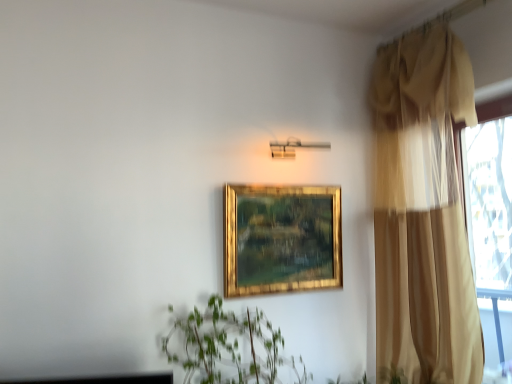
Question: Relative to beige sheer curtain at right, is gold/gilded picture frame at center in front or behind?

Choices:
 (A) front
 (B) behind

Answer: (B)

Question: From the image's perspective, relative to beige sheer curtain at right, is gold/gilded picture frame at center above or below?

Choices:
 (A) below
 (B) above

Answer: (A)

Question: Looking at their shapes, would you say gold/gilded picture frame at center is wider or thinner than beige sheer curtain at right?

Choices:
 (A) wide
 (B) thin

Answer: (B)

Question: Looking at their shapes, would you say beige sheer curtain at right is wider or thinner than gold/gilded picture frame at center?

Choices:
 (A) thin
 (B) wide

Answer: (B)

Question: Relative to gold/gilded picture frame at center, is beige sheer curtain at right in front or behind?

Choices:
 (A) front
 (B) behind

Answer: (A)

Question: From their relative heights in the image, would you say beige sheer curtain at right is taller or shorter than gold/gilded picture frame at center?

Choices:
 (A) short
 (B) tall

Answer: (B)

Question: From a real-world perspective, relative to gold/gilded picture frame at center, is beige sheer curtain at right vertically above or below?

Choices:
 (A) above
 (B) below

Answer: (A)